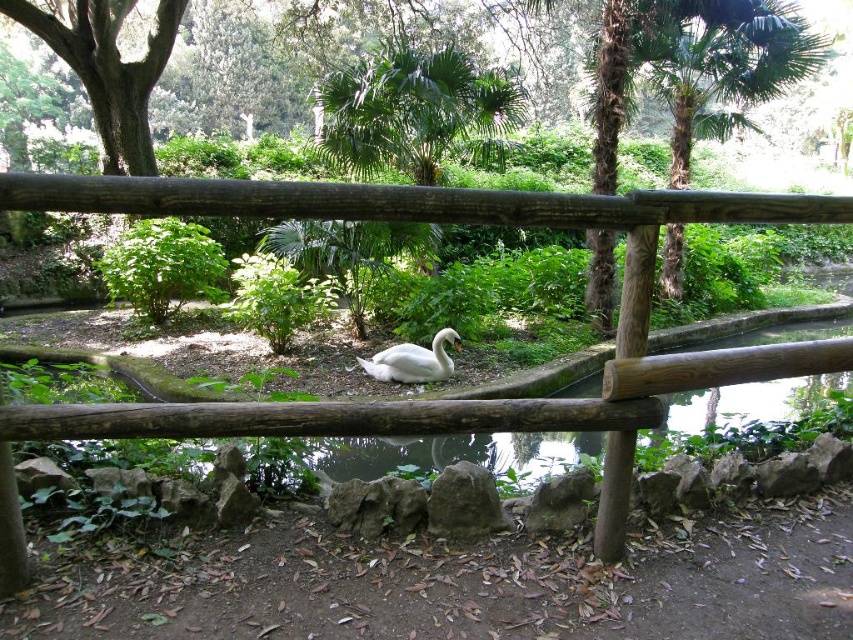
Question: Observing the image, what is the correct spatial positioning of wooden fence at center in reference to green leafy tree at center?

Choices:
 (A) right
 (B) left

Answer: (A)

Question: Considering the relative positions of green leafy tree at center and white glossy swan at center in the image provided, where is green leafy tree at center located with respect to white glossy swan at center?

Choices:
 (A) above
 (B) below

Answer: (A)

Question: Which object is closer to the camera taking this photo?

Choices:
 (A) green leafy tree at center
 (B) wooden fence at center
 (C) white glossy swan at center

Answer: (B)

Question: Which point is closer to the camera?

Choices:
 (A) wooden fence at center
 (B) green leafy tree at center
 (C) white glossy swan at center

Answer: (A)

Question: Among these points, which one is nearest to the camera?

Choices:
 (A) (73, 192)
 (B) (206, 182)
 (C) (418, 356)

Answer: (A)

Question: Can you confirm if wooden fence at center is positioned above white glossy swan at center?

Choices:
 (A) yes
 (B) no

Answer: (A)